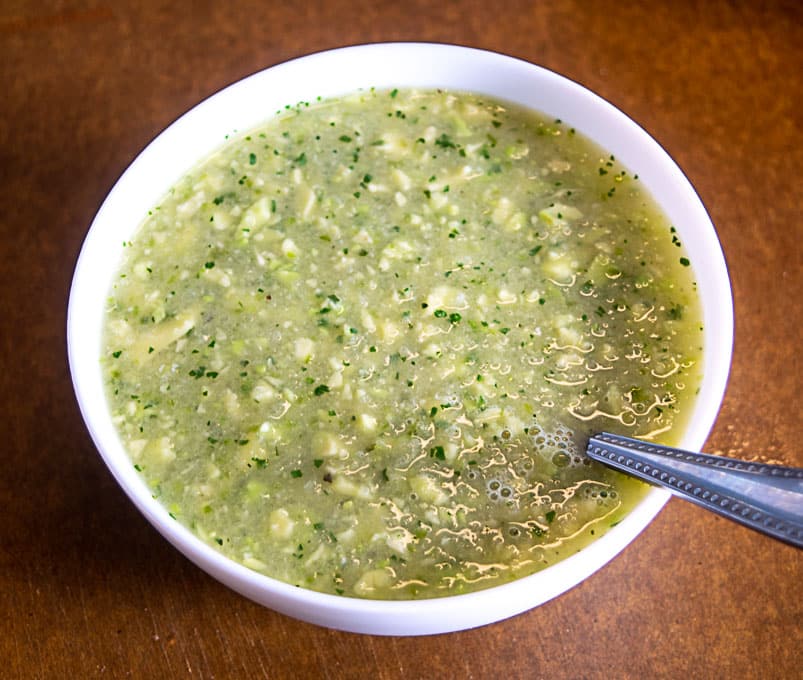
This screenshot has width=803, height=680. I want to click on rim of bowl, so click(x=292, y=90), click(x=311, y=596), click(x=718, y=269).